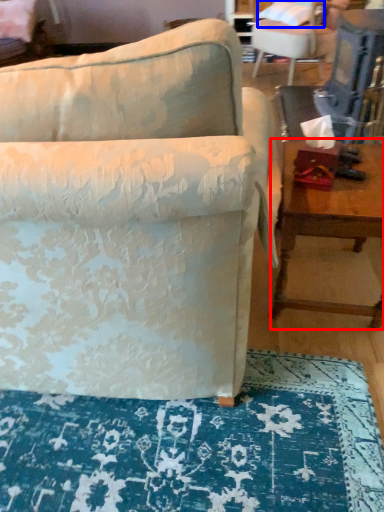
Question: Which point is closer to the camera, table (highlighted by a red box) or pillow (highlighted by a blue box)?

Choices:
 (A) table
 (B) pillow

Answer: (A)